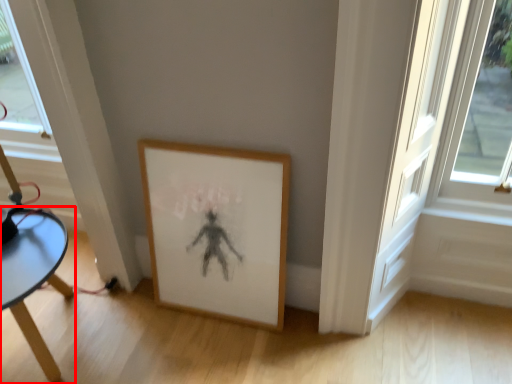
Question: From the image's perspective, considering the relative positions of table (annotated by the red box) and picture frame in the image provided, where is table (annotated by the red box) located with respect to the staircase?

Choices:
 (A) below
 (B) above

Answer: (A)